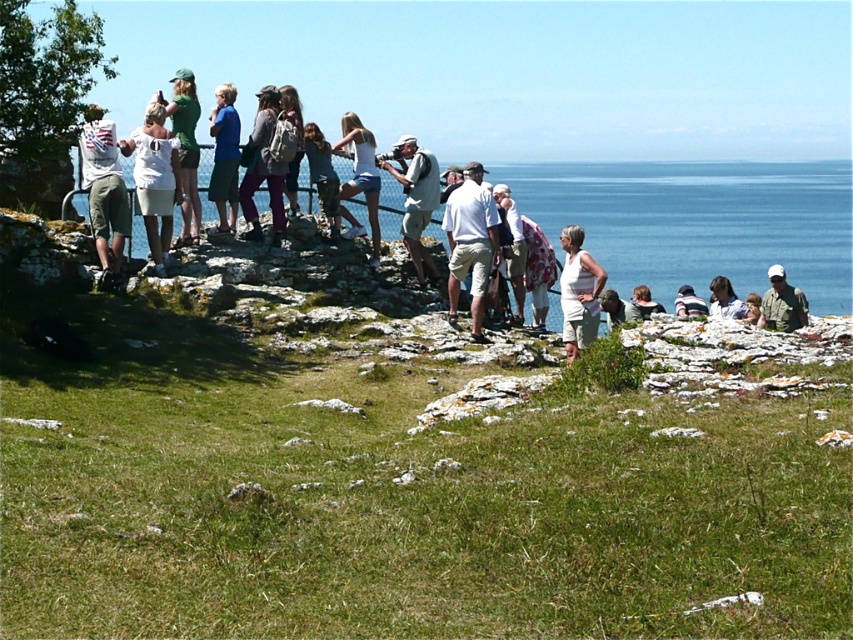
Measure the distance from matte purple pants at center to matte white shirt at center.

matte purple pants at center and matte white shirt at center are 20.97 feet apart.

Between point (260, 170) and point (718, 291), which one is positioned in front?

Point (260, 170)

Is point (248, 141) positioned in front of point (715, 296)?

Yes, point (248, 141) is closer to viewer.

Where is `matte purple pants at center`? This screenshot has width=853, height=640. matte purple pants at center is located at coordinates (263, 168).

Is point (198, 232) positioned before point (722, 289)?

Yes, point (198, 232) is in front of point (722, 289).

Is point (193, 182) closer to camera compared to point (724, 285)?

Yes, point (193, 182) is in front of point (724, 285).

Identify the location of green fabric shirt at upper left. (184, 150).

Who is taller, white cotton shirt at center or matte purple pants at center?

Standing taller between the two is white cotton shirt at center.

The image size is (853, 640). Describe the element at coordinates (469, 243) in the screenshot. I see `white cotton shirt at center` at that location.

Who is more forward, (480, 224) or (260, 108)?

A: Positioned in front is point (480, 224).

Locate an element on the screen. white cotton shirt at center is located at coordinates (469, 243).